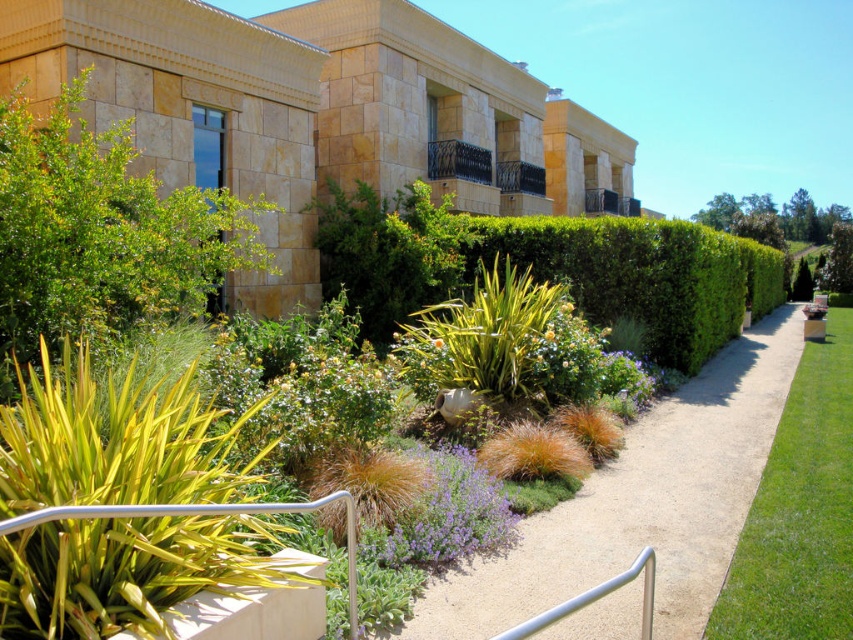
Based on the photo, is smooth gravel path at center above green leafy hedge at center?

No, smooth gravel path at center is not above green leafy hedge at center.

Is smooth gravel path at center to the left of green leafy hedge at center from the viewer's perspective?

Indeed, smooth gravel path at center is positioned on the left side of green leafy hedge at center.

Is point (645, 481) in front of point (753, 288)?

Yes, it is in front of point (753, 288).

You are a GUI agent. You are given a task and a screenshot of the screen. Output one action in this format:
    pyautogui.click(x=<x>, y=<y>)
    Task: Click on the smooth gravel path at center
    The image size is (853, 640).
    Given the screenshot: What is the action you would take?
    pyautogui.click(x=641, y=502)

Which of these two, smooth gravel path at center or yellow matte flower at center, stands taller?

Standing taller between the two is smooth gravel path at center.

Can you confirm if smooth gravel path at center is wider than yellow matte flower at center?

Indeed, smooth gravel path at center has a greater width compared to yellow matte flower at center.

Which is in front, point (614, 460) or point (434, 346)?

Point (614, 460) is more forward.

Find the location of `smooth gravel path at center`. smooth gravel path at center is located at coordinates (641, 502).

Does smooth gravel path at center have a larger size compared to purple soft-textured flower at center?

Correct, smooth gravel path at center is larger in size than purple soft-textured flower at center.

What do you see at coordinates (641, 502) in the screenshot? This screenshot has height=640, width=853. I see `smooth gravel path at center` at bounding box center [641, 502].

I want to click on smooth gravel path at center, so click(641, 502).